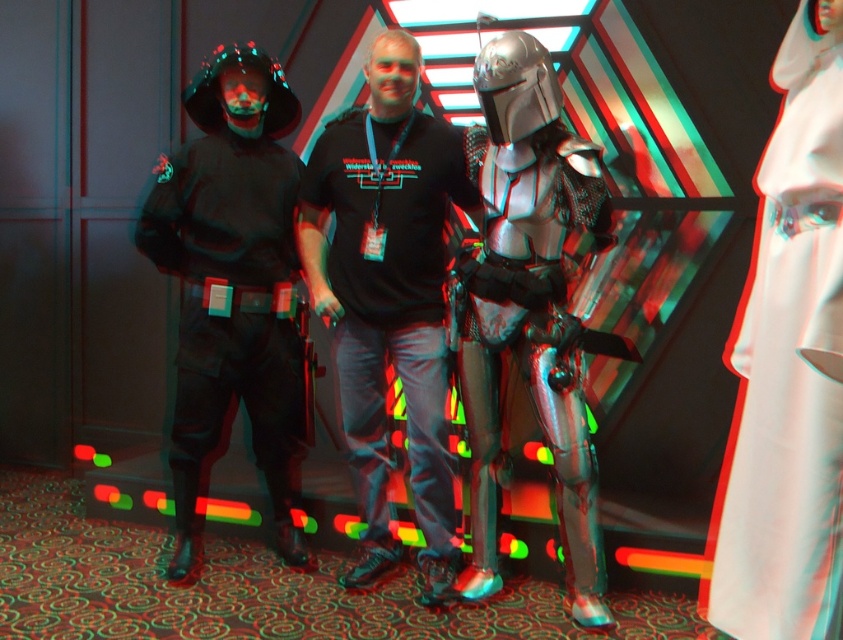
You are a photographer at this event and want to capture a photo of the white satin dress at center and the shiny silver armor at center. From the photographer perspective, which object is on the right side?

The white satin dress at center is positioned on the right side of the shiny silver armor at center, so from the photographer perspective, the white satin dress at center is on the right side.

You are a photographer at the event and want to capture a photo of the white satin dress at center. Based on its coordinates, where should you position your camera to ensure it is centered in the frame?

The white satin dress at center is located at coordinates point (788, 365), so positioning the camera to focus on that point will center it in the frame.